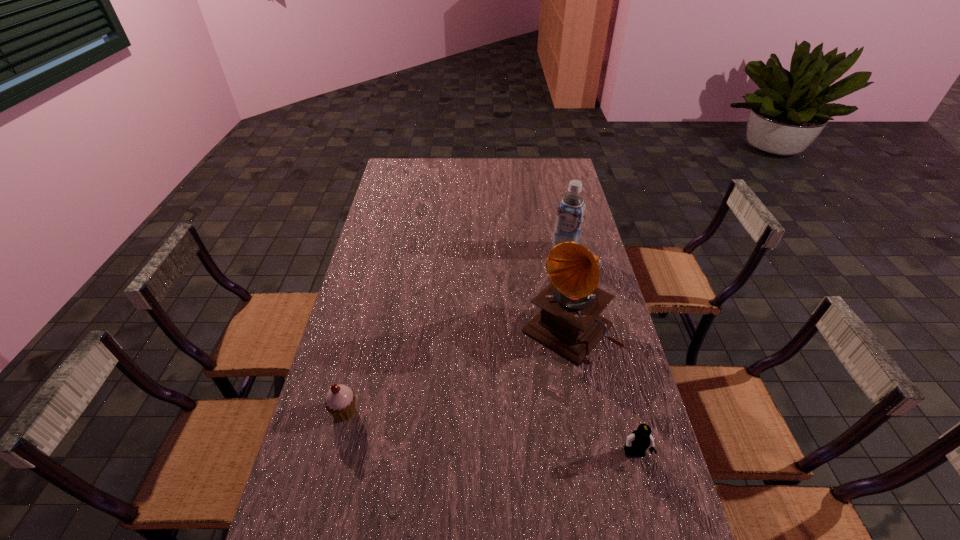
Find the location of a particular element. Image resolution: width=960 pixels, height=540 pixels. cupcake is located at coordinates (340, 402).

You are a GUI agent. You are given a task and a screenshot of the screen. Output one action in this format:
    pyautogui.click(x=<x>, y=<y>)
    Task: Click on the third farthest object
    Image resolution: width=960 pixels, height=540 pixels.
    Given the screenshot: What is the action you would take?
    pyautogui.click(x=340, y=402)

Locate an element on the screen. the nearest object is located at coordinates (639, 440).

Locate an element on the screen. The width and height of the screenshot is (960, 540). soya milk is located at coordinates (570, 215).

This screenshot has height=540, width=960. What are the coordinates of `the third shortest object` in the screenshot? It's located at (570, 215).

This screenshot has width=960, height=540. Identify the location of the tallest object. (569, 322).

Find the location of a particular element. phonograph record is located at coordinates (569, 322).

The height and width of the screenshot is (540, 960). What are the coordinates of `blank area located 0.180m on the right of the second nearest object` in the screenshot? It's located at (425, 411).

Find the location of a particular element. vacant point located 0.100m on the front-facing side of the nearest object is located at coordinates point(648,505).

This screenshot has height=540, width=960. Find the location of `free space located on the label of the farthest object`. free space located on the label of the farthest object is located at coordinates tap(555, 269).